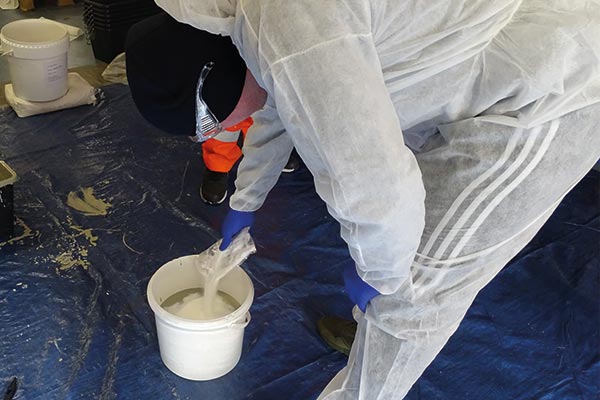
Locate an element on the screen. The width and height of the screenshot is (600, 400). blue floor is located at coordinates (465, 358).